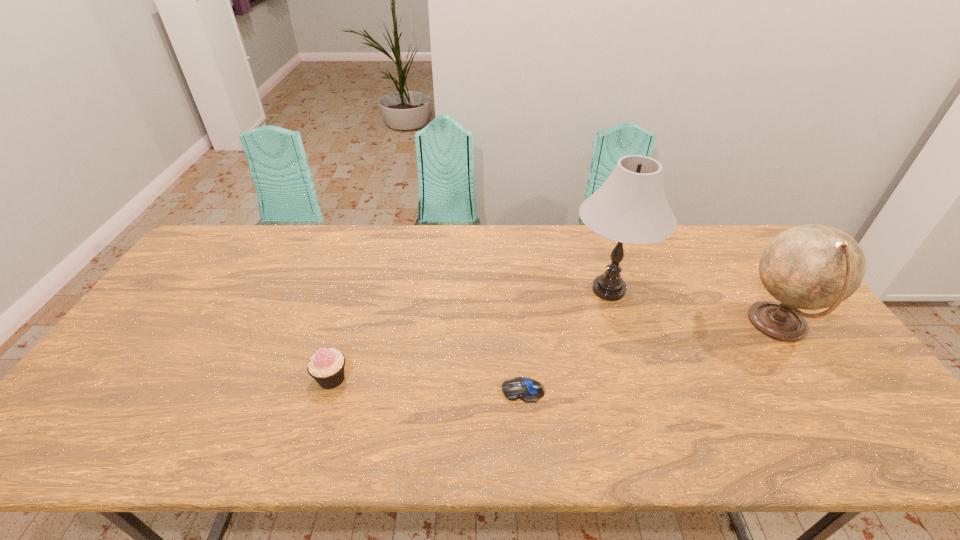
Locate an element on the screen. The height and width of the screenshot is (540, 960). the tallest object is located at coordinates (630, 207).

Where is `the second object from right to left`? the second object from right to left is located at coordinates click(x=630, y=207).

Image resolution: width=960 pixels, height=540 pixels. I want to click on globe, so click(x=813, y=266).

What are the coordinates of `the third shortest object` in the screenshot? It's located at (813, 266).

Find the location of `cupcake`. cupcake is located at coordinates (326, 366).

This screenshot has width=960, height=540. I want to click on the leftmost object, so click(x=326, y=366).

The height and width of the screenshot is (540, 960). I want to click on the third object from right to left, so click(x=526, y=389).

I want to click on the shortest object, so click(526, 389).

Find the location of `vacant space located 0.060m on the back of the tallest object`. vacant space located 0.060m on the back of the tallest object is located at coordinates [596, 253].

You are a GUI agent. You are given a task and a screenshot of the screen. Output one action in this format:
    pyautogui.click(x=<x>, y=<y>)
    Task: Click on the vacant region located on the front-facing side of the rightmost object
    The image size is (960, 540).
    Given the screenshot: What is the action you would take?
    pyautogui.click(x=701, y=325)